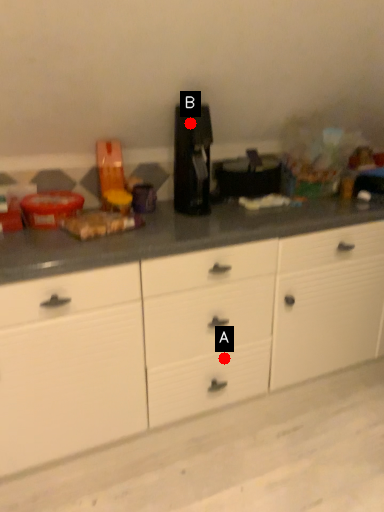
Question: Two points are circled on the image, labeled by A and B beside each circle. Among these points, which one is nearest to the camera?

Choices:
 (A) A is closer
 (B) B is closer

Answer: (B)